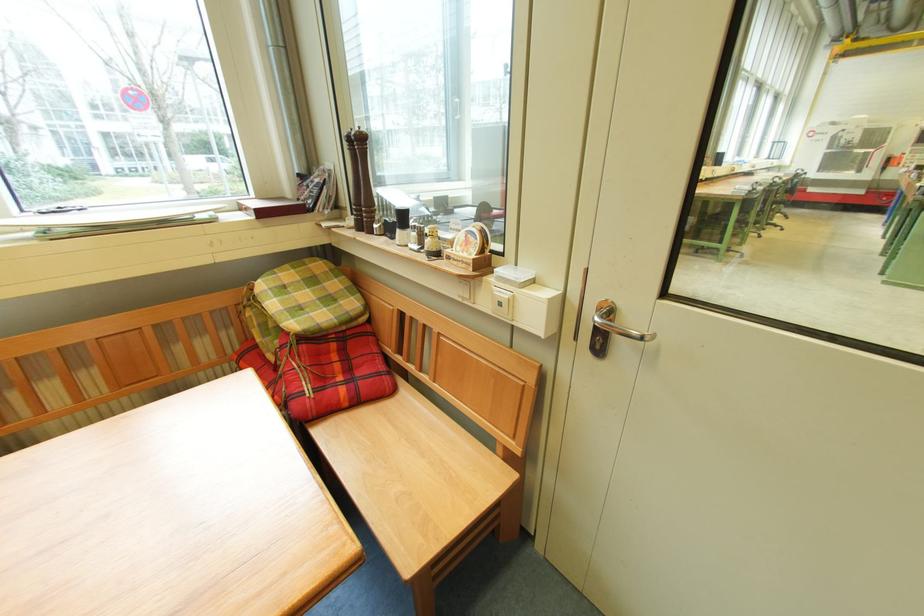
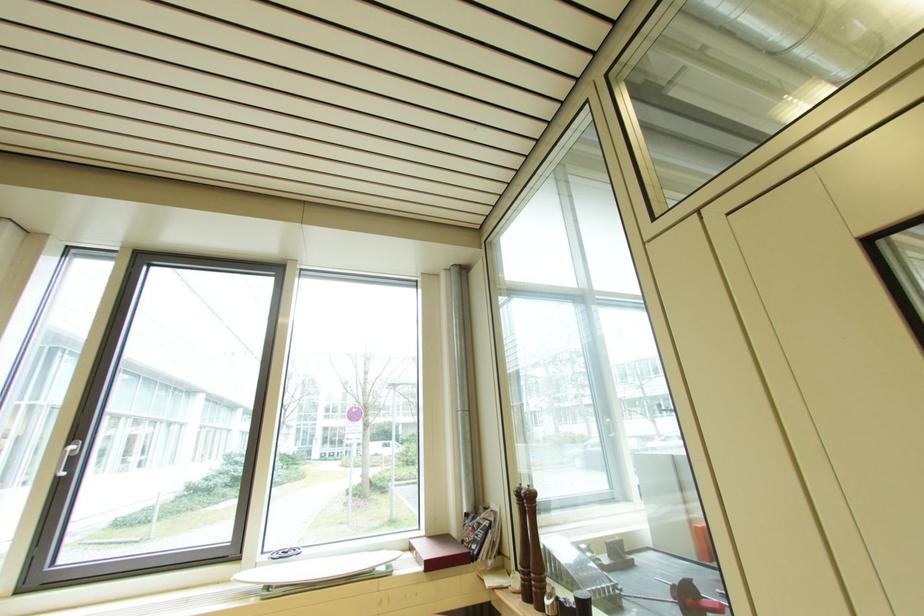
Where in the second image is the point corresponding to (x=397, y=224) from the first image?

(574, 605)